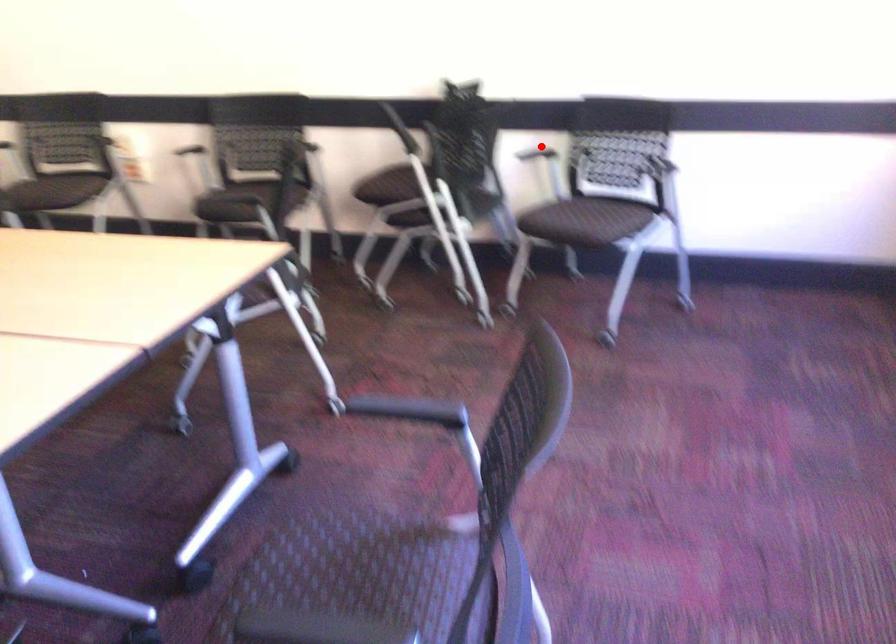
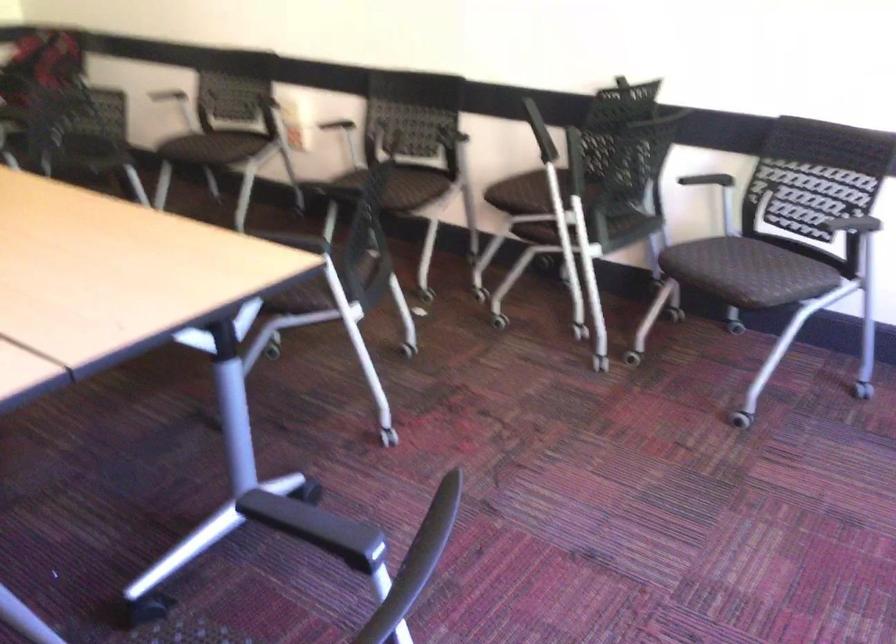
Question: I am providing you with two images of the same scene from different viewpoints. A red point is shown in image1. For the corresponding object point in image2, is it positioned nearer or farther from the camera?

Choices:
 (A) Nearer
 (B) Farther

Answer: (A)